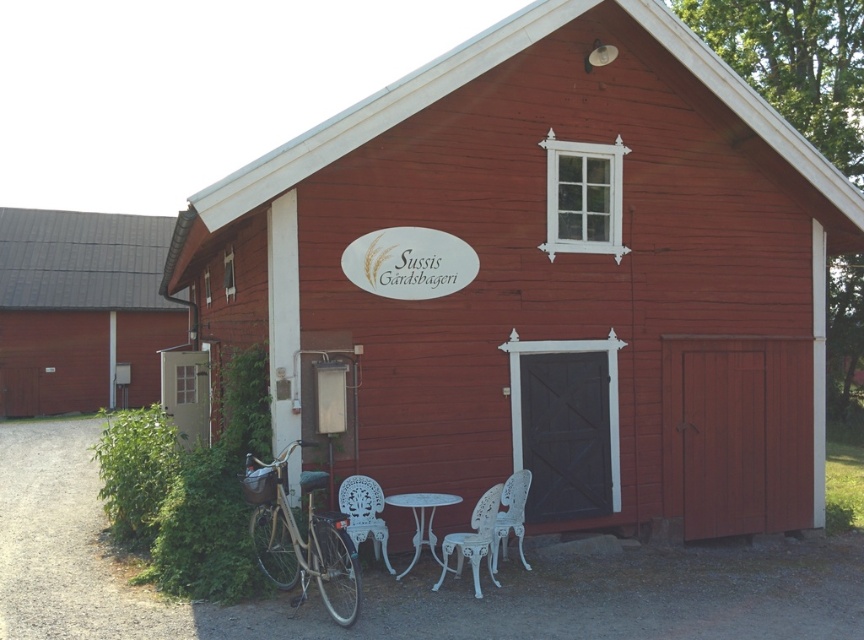
You are a visitor at the rustic red wooden building and want to park your bicycle. The shiny silver bicycle at lower left and the white plastic chair at lower center are already there. Which object is positioned higher up relative to the ground?

The shiny silver bicycle at lower left is located above the white plastic chair at lower center, meaning it is positioned higher up relative to the ground.

You are a delivery person with a cart that is 1.2 meters wide. You need to move the shiny silver bicycle at lower left out of the way to access the white metal table at lower center. Is there enough space between them for your cart to pass through?

The distance between the shiny silver bicycle at lower left and the white metal table at lower center is 1.15 meters. Since your cart is 1.2 meters wide, there isn t enough space for the cart to pass through.

You are standing in front of the rustic red wooden building with white trim. You notice a point marked at coordinates [81,308]. Which object does this point belong to?

The point at coordinates [81,308] is on the brown wooden door at left.